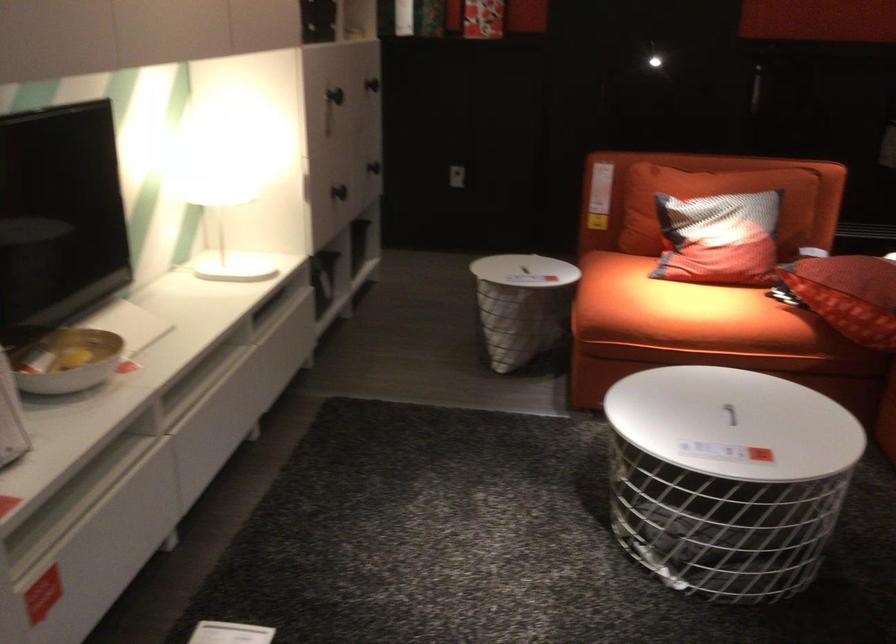
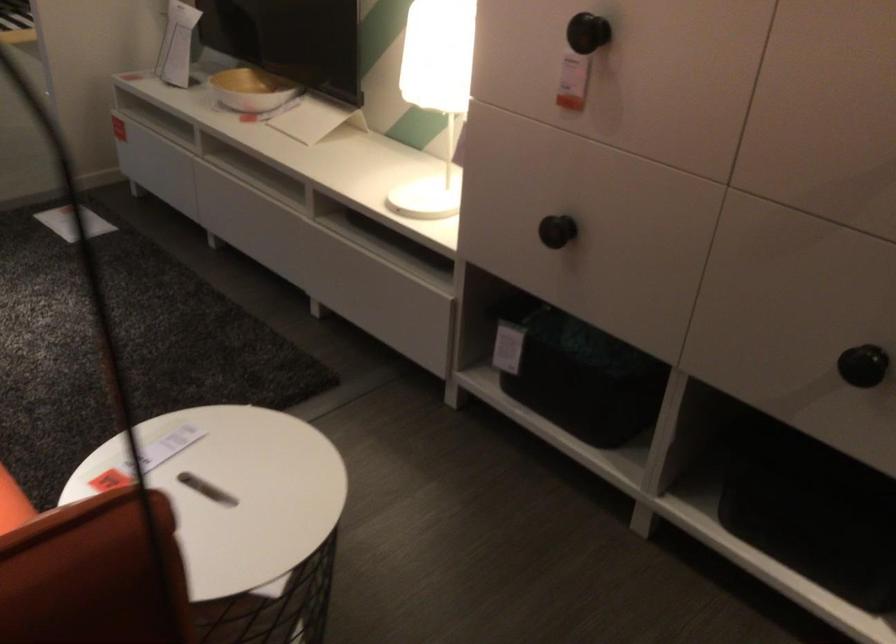
Locate, in the second image, the point that corresponds to (348,89) in the first image.

(588, 33)